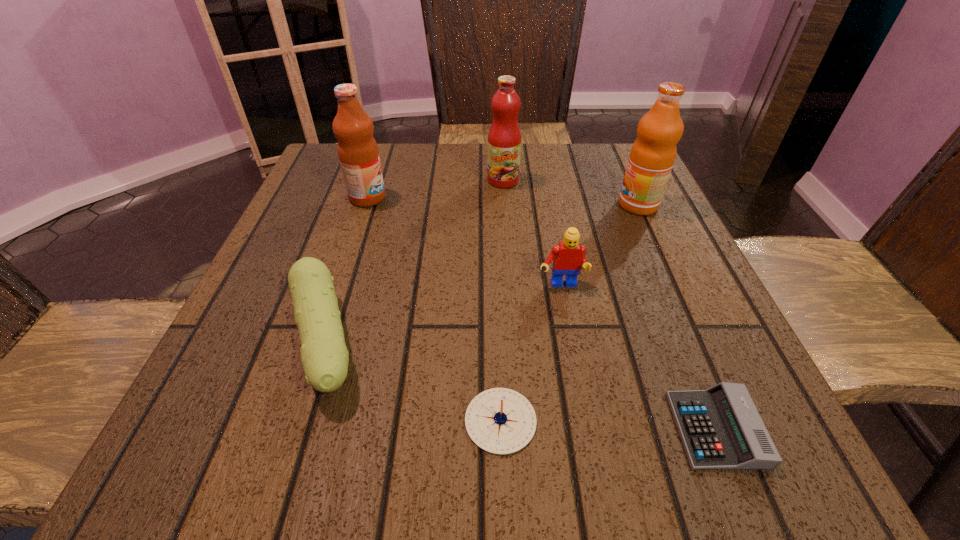
The width and height of the screenshot is (960, 540). Identify the location of free space located 0.150m on the label side of the rightmost fruit juice. (548, 205).

Where is `free space located 0.210m on the front label of the leftmost fruit juice`? Image resolution: width=960 pixels, height=540 pixels. free space located 0.210m on the front label of the leftmost fruit juice is located at coordinates (482, 198).

Find the location of a particular element. The height and width of the screenshot is (540, 960). vacant space situated on the front label of the second fruit juice from left to right is located at coordinates (511, 295).

At what (x,y) coordinates should I click in order to perform the action: click on vacant space situated 0.310m on the front-facing side of the Lego. Please return your answer as a coordinate pair (x, y). The width and height of the screenshot is (960, 540). Looking at the image, I should click on (597, 478).

Find the location of a particular element. The width and height of the screenshot is (960, 540). vacant space located 0.360m on the back of the third shortest object is located at coordinates (376, 179).

Locate an element on the screen. This screenshot has height=540, width=960. vacant region located on the left of the compass is located at coordinates (210, 421).

Locate an element on the screen. This screenshot has height=540, width=960. free space located on the left of the calculator is located at coordinates (503, 429).

In order to click on compass that is positioned at the near edge in this screenshot , I will do `click(501, 421)`.

This screenshot has width=960, height=540. In order to click on calculator at the near edge in this screenshot , I will do [x=721, y=429].

Where is `fruit juice located in the left edge section of the desktop`? The height and width of the screenshot is (540, 960). fruit juice located in the left edge section of the desktop is located at coordinates [358, 153].